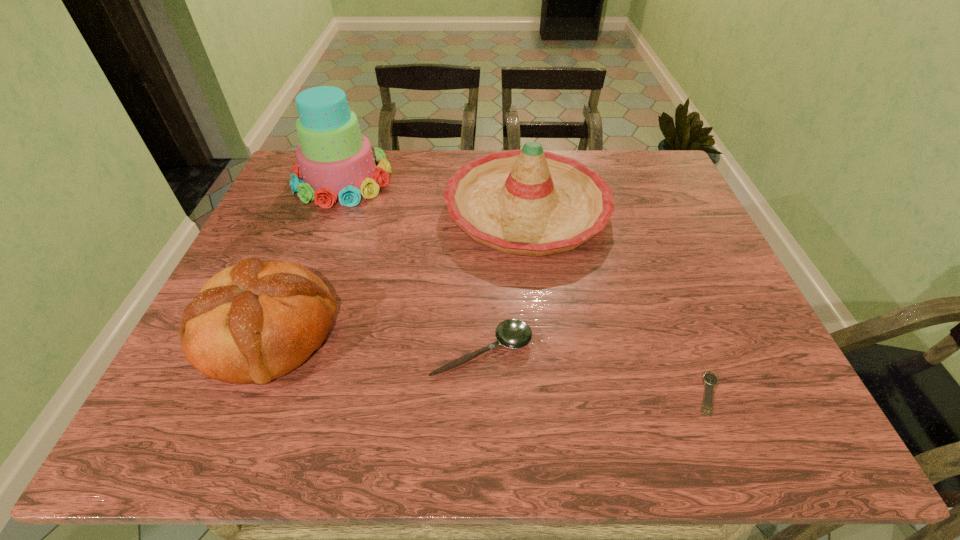
The image size is (960, 540). What are the coordinates of `empty space between the fourth tallest object and the bread` in the screenshot? It's located at (375, 342).

The image size is (960, 540). Identify the location of vacant space in between the fourth tallest object and the second tallest object. (505, 280).

Find the location of a particular element. The height and width of the screenshot is (540, 960). vacant area that lies between the cake and the sombrero is located at coordinates (435, 194).

Identify the location of the third closest object to the third tallest object. The image size is (960, 540). (336, 162).

Identify which object is the third nearest to the rightmost object. Please provide its 2D coordinates. Your answer should be formatted as a tuple, i.e. [(x, y)], where the tuple contains the x and y coordinates of a point satisfying the conditions above.

[(255, 321)]

Where is `free spot that satisfies the following two spatial constraints: 1. on the front side of the third shortest object; 2. on the right side of the watch`? The width and height of the screenshot is (960, 540). free spot that satisfies the following two spatial constraints: 1. on the front side of the third shortest object; 2. on the right side of the watch is located at coordinates (244, 394).

You are a GUI agent. You are given a task and a screenshot of the screen. Output one action in this format:
    pyautogui.click(x=<x>, y=<y>)
    Task: Click on the blank area in the image that satisfies the following two spatial constraints: 1. on the back side of the bread; 2. on the left side of the sombrero
    
    Given the screenshot: What is the action you would take?
    pyautogui.click(x=320, y=210)

The height and width of the screenshot is (540, 960). Find the location of `free space that satisfies the following two spatial constraints: 1. on the front side of the bread; 2. on the left side of the fourth tallest object`. free space that satisfies the following two spatial constraints: 1. on the front side of the bread; 2. on the left side of the fourth tallest object is located at coordinates (261, 351).

This screenshot has width=960, height=540. Find the location of `free spot that satisfies the following two spatial constraints: 1. on the front side of the rightmost object; 2. on the right side of the ladle`. free spot that satisfies the following two spatial constraints: 1. on the front side of the rightmost object; 2. on the right side of the ladle is located at coordinates (482, 394).

Find the location of a particular element. This screenshot has width=960, height=540. blank area in the image that satisfies the following two spatial constraints: 1. on the front side of the tallest object; 2. on the left side of the sombrero is located at coordinates (331, 210).